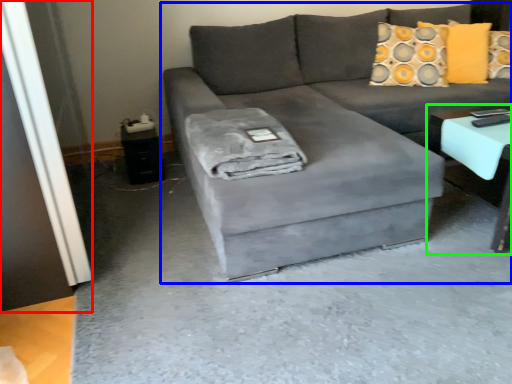
Question: Considering the real-world distances, which object is farthest from glass door (highlighted by a red box)? studio couch (highlighted by a blue box) or table (highlighted by a green box)?

Choices:
 (A) studio couch
 (B) table

Answer: (B)